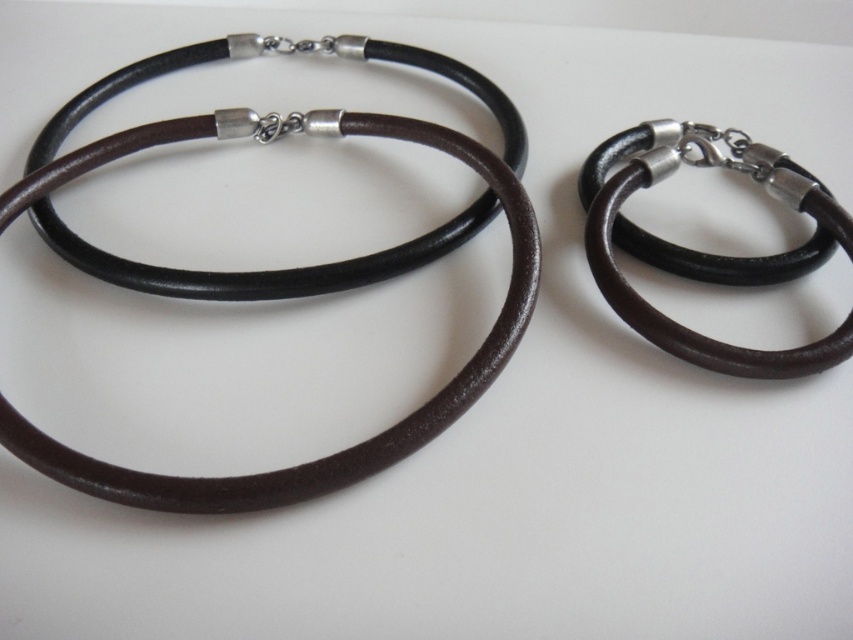
You are an appraiser examining the jewelry layout. The two necklaces are looped around each other, and the bracelet is on the right. There is a specific point marked at coordinates (279,276). Which jewelry piece does this point correspond to?

The point at coordinates (279,276) corresponds to the brown leather necklace at left.

You are looking at the jewelry arrangement and need to determine which point is nearer to you. The points are labeled as point 1 at coordinates point (474, 387) and point 2 at coordinates point (579, 186). Which point is closer to your viewpoint?

Point (474, 387) is closer to the viewer than point (579, 186).